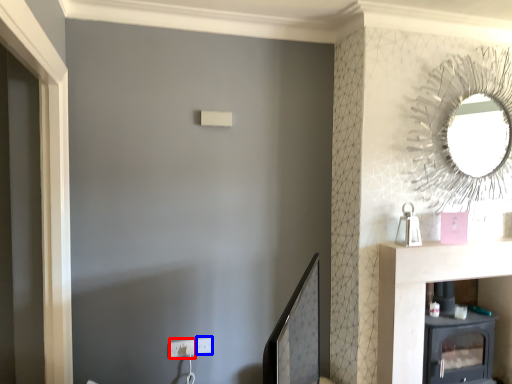
Question: Among these objects, which one is farthest to the camera, electric outlet (highlighted by a red box) or electric outlet (highlighted by a blue box)?

Choices:
 (A) electric outlet
 (B) electric outlet

Answer: (B)